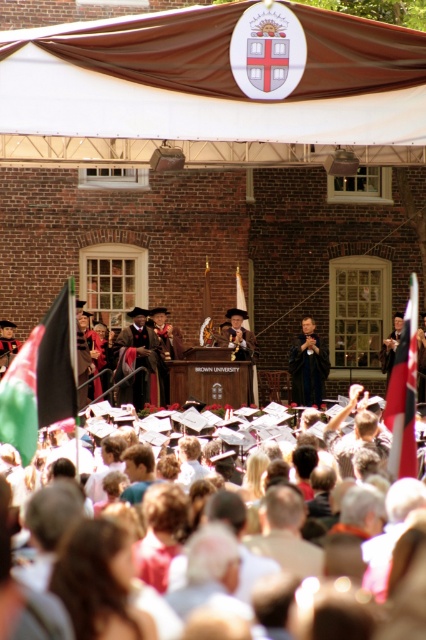
Does white paper hats at center have a lesser width compared to red fabric flag at center?

Correct, white paper hats at center's width is less than red fabric flag at center's.

Can you confirm if white paper hats at center is positioned below red fabric flag at center?

Yes, white paper hats at center is below red fabric flag at center.

Who is more distant from viewer, (x=347, y=600) or (x=409, y=310)?

Point (x=409, y=310)

Locate an element on the screen. Image resolution: width=426 pixels, height=640 pixels. white paper hats at center is located at coordinates click(x=368, y=596).

Does green fabric flag at left have a lesser height compared to red fabric flag at center?

Correct, green fabric flag at left is not as tall as red fabric flag at center.

This screenshot has height=640, width=426. Describe the element at coordinates (40, 378) in the screenshot. I see `green fabric flag at left` at that location.

This screenshot has width=426, height=640. In order to click on green fabric flag at left in this screenshot , I will do click(40, 378).

Between white paper hats at center and velvet black gown at center, which one appears on the left side from the viewer's perspective?

velvet black gown at center is more to the left.

Does white paper hats at center have a smaller size compared to velvet black gown at center?

Actually, white paper hats at center might be larger than velvet black gown at center.

Which is in front, point (414, 618) or point (132, 348)?

Point (414, 618) is in front.

At what (x,y) coordinates should I click in order to perform the action: click on white paper hats at center. Please return your answer as a coordinate pair (x, y). The image size is (426, 640). Looking at the image, I should click on (x=368, y=596).